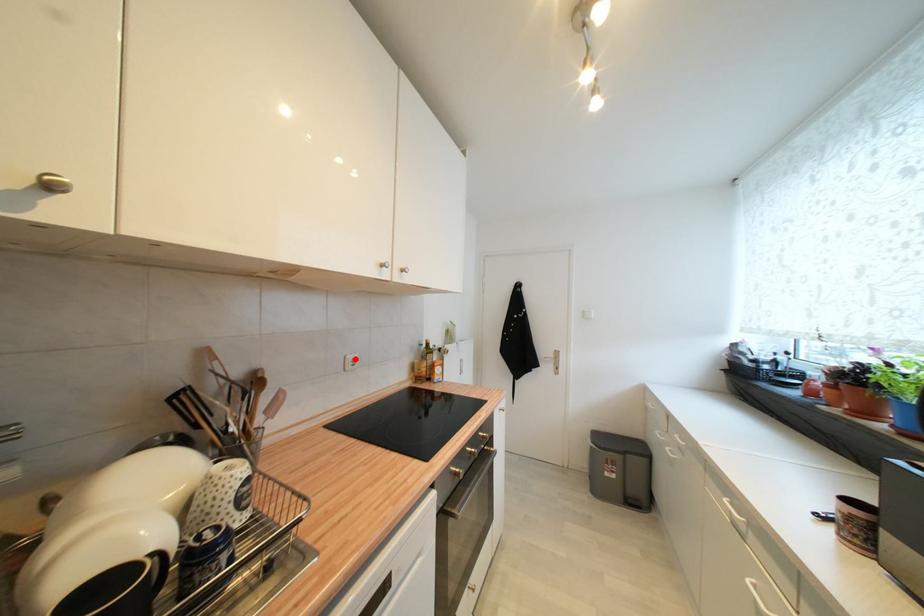
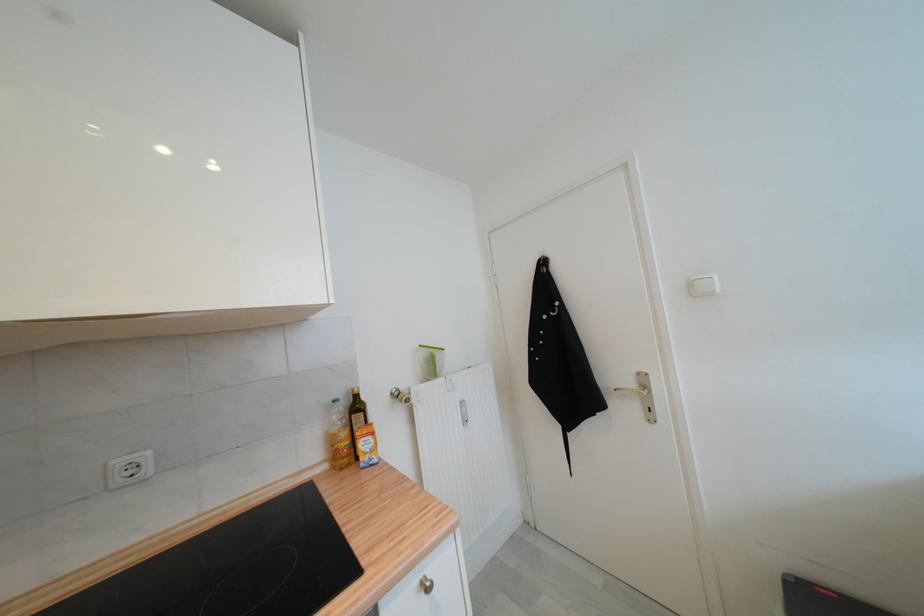
Find the pixel in the second image that matches the highlighted location in the first image.

(126, 464)